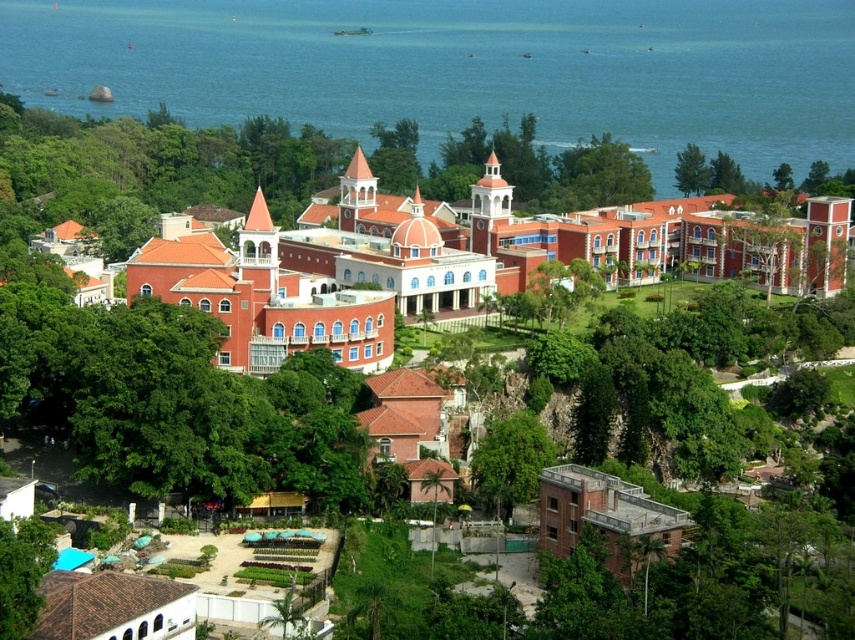
You are standing on the hillside near the large ornate building and want to get to the blue water at upper center. Which direction should you walk relative to the green leafy tree at center?

You should walk towards the upper direction relative to the green leafy tree at center because the blue water at upper center is positioned above it.

You are an architect planning to add a new structure near the green leafy tree at center and the green leafy tree at upper right. Which tree should you consider for placement if you need a larger area due to its size?

The green leafy tree at upper right is larger, so you should consider placing the new structure near it to accommodate the larger area required.

You are an architect analyzing the layout of the building and its surroundings. Based on the image, what are the coordinates of the blue water at upper center in the 2D plane?

The coordinates of the blue water at upper center are at point (464, 68).